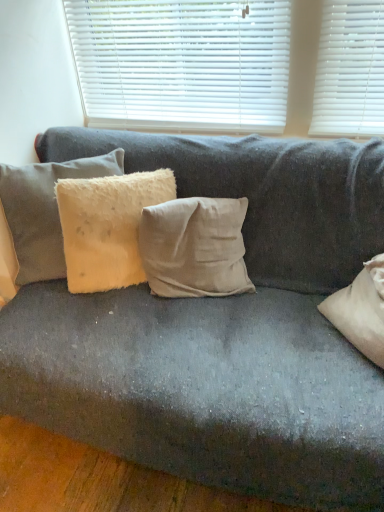
Question: Does white plastic blinds at upper center have a larger size compared to beige cotton cushion at center, placed as the 3th pillow when sorted from left to right?

Choices:
 (A) yes
 (B) no

Answer: (B)

Question: Is white plastic blinds at upper center thinner than beige cotton cushion at center, which is counted as the first pillow, starting from the right?

Choices:
 (A) no
 (B) yes

Answer: (B)

Question: Is white plastic blinds at upper center behind beige cotton cushion at center, which is counted as the first pillow, starting from the right?

Choices:
 (A) no
 (B) yes

Answer: (B)

Question: Could you tell me if white plastic blinds at upper center is facing beige cotton cushion at center, placed as the 3th pillow when sorted from left to right?

Choices:
 (A) yes
 (B) no

Answer: (B)

Question: From the image's perspective, is white plastic blinds at upper center located beneath beige cotton cushion at center, placed as the 3th pillow when sorted from left to right?

Choices:
 (A) yes
 (B) no

Answer: (B)

Question: Are white plastic blinds at upper center and beige cotton cushion at center, placed as the 3th pillow when sorted from left to right, beside each other?

Choices:
 (A) yes
 (B) no

Answer: (B)

Question: From the image's perspective, is fuzzy beige pillow at left, which appears as the 1th pillow when viewed from the left, below white plastic blinds at upper center?

Choices:
 (A) yes
 (B) no

Answer: (A)

Question: Are fuzzy beige pillow at left, the third pillow when ordered from right to left, and white plastic blinds at upper center beside each other?

Choices:
 (A) yes
 (B) no

Answer: (B)

Question: Could you tell me if fuzzy beige pillow at left, which appears as the 1th pillow when viewed from the left, is turned towards white plastic blinds at upper center?

Choices:
 (A) yes
 (B) no

Answer: (B)

Question: Is fuzzy beige pillow at left, which appears as the 1th pillow when viewed from the left, taller than white plastic blinds at upper center?

Choices:
 (A) no
 (B) yes

Answer: (A)

Question: From a real-world perspective, is fuzzy beige pillow at left, which appears as the 1th pillow when viewed from the left, positioned under white plastic blinds at upper center based on gravity?

Choices:
 (A) no
 (B) yes

Answer: (B)

Question: Is fuzzy beige pillow at left, which appears as the 1th pillow when viewed from the left, shorter than white plastic blinds at upper center?

Choices:
 (A) yes
 (B) no

Answer: (A)

Question: Is fuzzy beige pillow at left, which appears as the 1th pillow when viewed from the left, turned away from fuzzy beige pillow at center, arranged as the 2th pillow when viewed from the left?

Choices:
 (A) yes
 (B) no

Answer: (B)